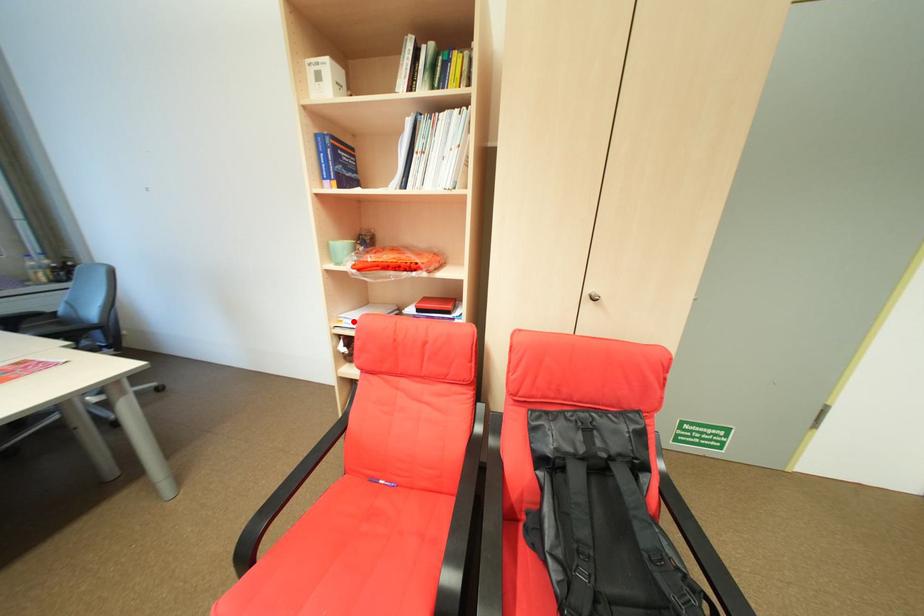
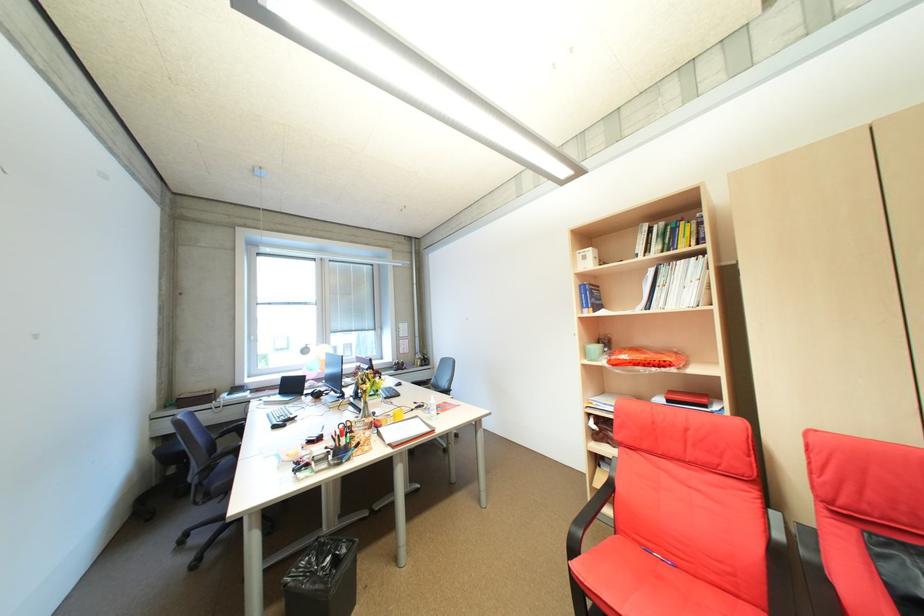
In the second image, find the point that corresponds to the highlighted location in the first image.

(603, 403)